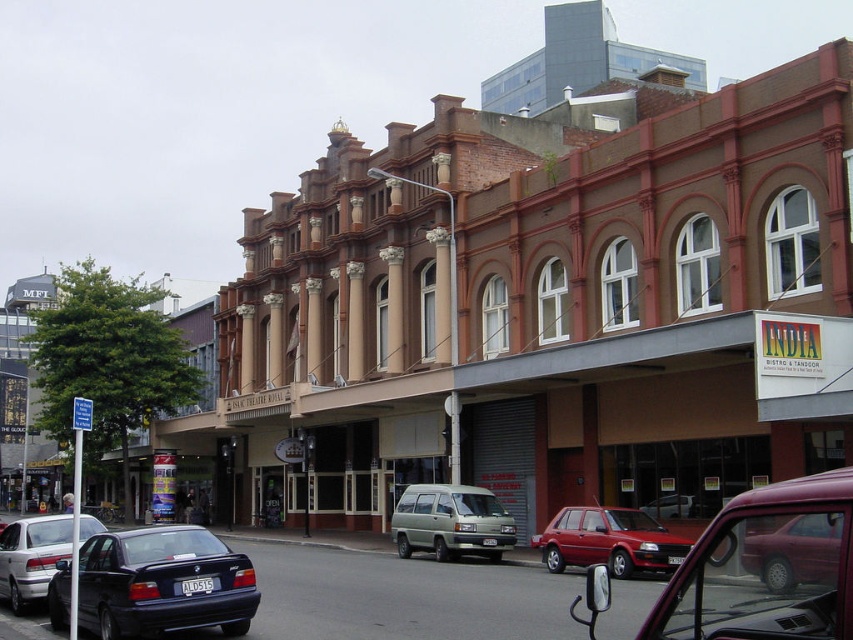
From the picture: You are a delivery driver who needs to park your vehicle in this area. You have a delivery van that is the same size as the light green matte van at center. There is a silver metallic sedan at lower left blocking the parking spot. Can you park your van without moving the sedan?

The light green matte van at center is located below the silver metallic sedan at lower left, meaning the sedan is parked above the van. Since the sedan is blocking the parking spot, you cannot park your van there without moving the sedan.

You are a delivery person who needs to park your 4.5 meters long truck in front of India Bistro. The truck requires a parking spot that is at least 5 meters long. Based on the scene, can you determine if there is enough space between the metallic red sedan at center and the white van to the left of it?

The position of metallic red sedan at center is at point [608,541]. However, without knowing the exact position of the white van, it is impossible to determine the distance between them. Therefore, you cannot confirm if there is enough space for your truck.